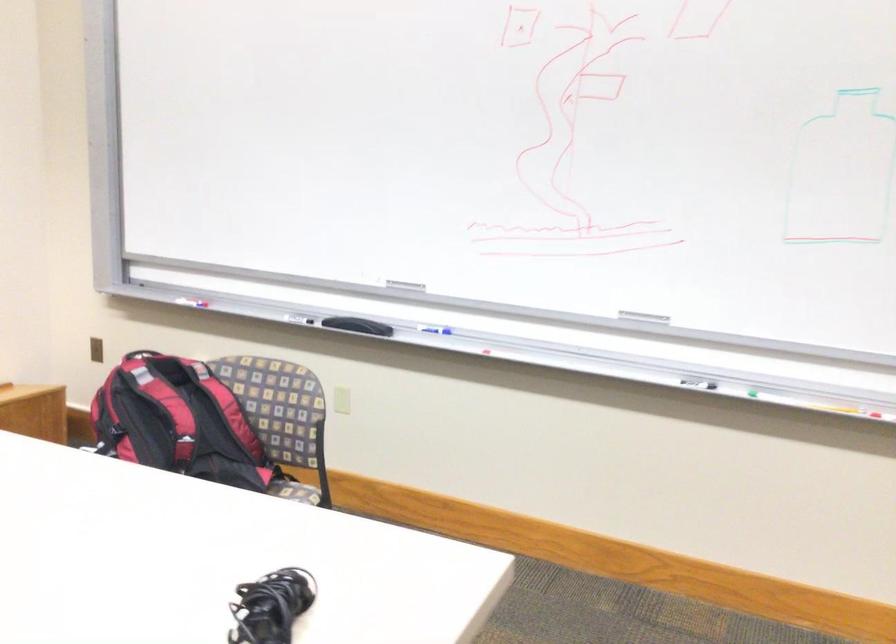
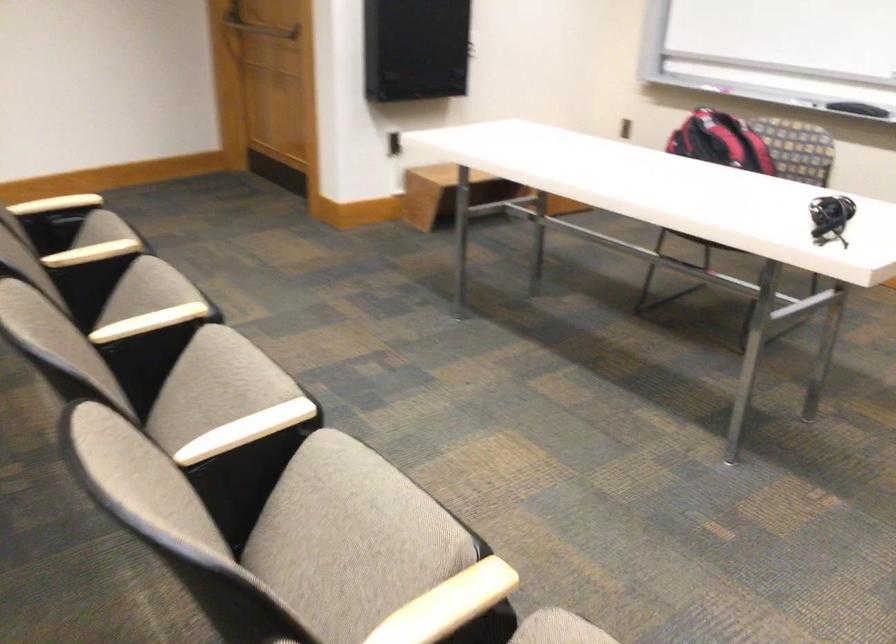
Where in the second image is the point corresponding to (170,418) from the first image?

(720, 142)